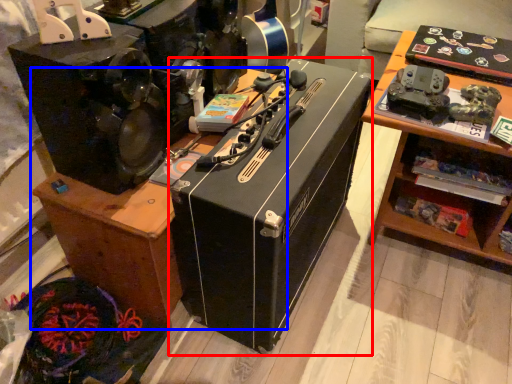
Question: Which object is closer to the camera taking this photo, box (highlighted by a red box) or furniture (highlighted by a blue box)?

Choices:
 (A) box
 (B) furniture

Answer: (A)